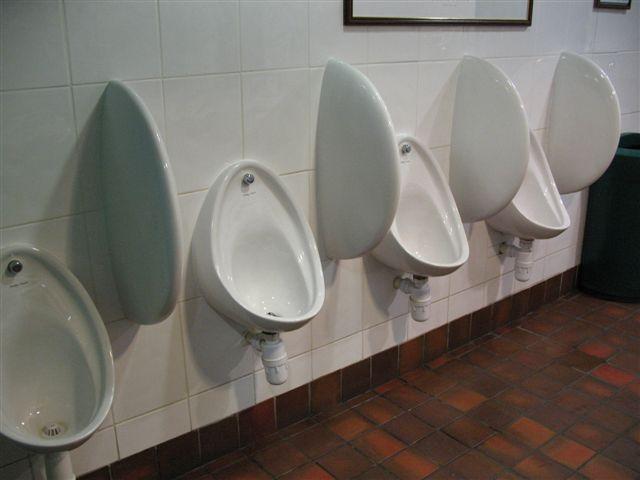
This screenshot has height=480, width=640. I want to click on frame of picture, so click(427, 20).